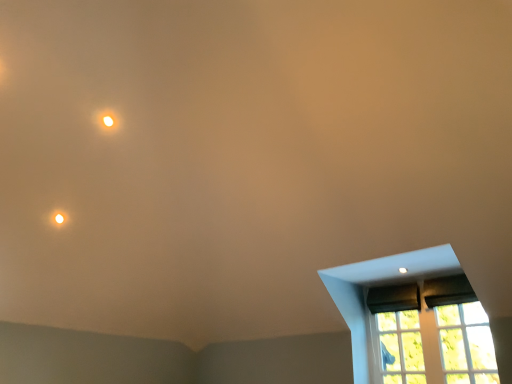
Question: Is transparent glass window at lower right, the first glass window when ordered from right to left, closer to the viewer compared to matte white light at upper left?

Choices:
 (A) yes
 (B) no

Answer: (A)

Question: Is matte white light at upper left inside transparent glass window at lower right, the second glass window positioned from the left?

Choices:
 (A) no
 (B) yes

Answer: (A)

Question: Is transparent glass window at lower right, the second glass window positioned from the left, at the left side of matte white light at upper left?

Choices:
 (A) yes
 (B) no

Answer: (B)

Question: Is transparent glass window at lower right, the second glass window positioned from the left, touching matte white light at upper left?

Choices:
 (A) no
 (B) yes

Answer: (A)

Question: Could you tell me if transparent glass window at lower right, the second glass window positioned from the left, is turned towards matte white light at upper left?

Choices:
 (A) yes
 (B) no

Answer: (B)

Question: Is matte black window at lower right bigger or smaller than matte white light at upper left?

Choices:
 (A) small
 (B) big

Answer: (B)

Question: Is point (361, 266) closer or farther from the camera than point (110, 117)?

Choices:
 (A) farther
 (B) closer

Answer: (B)

Question: Considering the positions of matte black window at lower right and matte white light at upper left in the image, is matte black window at lower right wider or thinner than matte white light at upper left?

Choices:
 (A) wide
 (B) thin

Answer: (A)

Question: In the image, is matte black window at lower right positioned in front of or behind matte white light at upper left?

Choices:
 (A) front
 (B) behind

Answer: (A)

Question: From a real-world perspective, is transparent glass window at lower right, the second glass window positioned from the left, positioned above or below matte white light at upper left?

Choices:
 (A) above
 (B) below

Answer: (B)

Question: From their relative heights in the image, would you say transparent glass window at lower right, the second glass window positioned from the left, is taller or shorter than matte white light at upper left?

Choices:
 (A) short
 (B) tall

Answer: (B)

Question: Relative to matte white light at upper left, is transparent glass window at lower right, the first glass window when ordered from right to left, in front or behind?

Choices:
 (A) behind
 (B) front

Answer: (B)

Question: Is point (474, 334) closer or farther from the camera than point (101, 115)?

Choices:
 (A) closer
 (B) farther

Answer: (A)

Question: Is matte white light at upper left to the left or to the right of transparent glass window at lower right, the first glass window when ordered from right to left, in the image?

Choices:
 (A) right
 (B) left

Answer: (B)

Question: From the image's perspective, relative to transparent glass window at lower right, the first glass window when ordered from right to left, is matte white light at upper left above or below?

Choices:
 (A) above
 (B) below

Answer: (A)